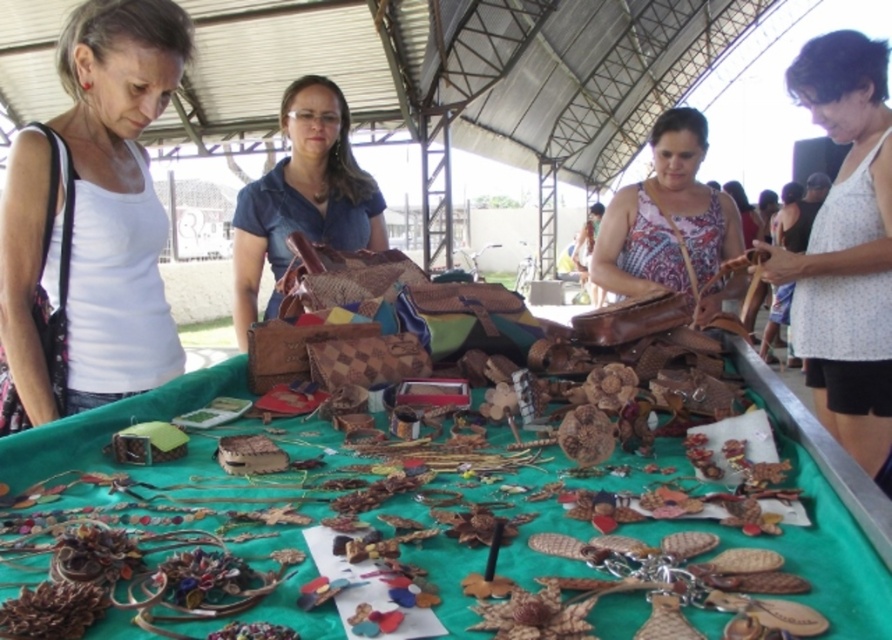
Looking at this image, you are a vendor at the market and want to display both the matte brown leather purse at center and the patterned fabric purse at center on a shelf. If the shelf has a width of 30 cm, can both purses fit side by side?

The matte brown leather purse at center is larger in width than the patterned fabric purse at center. However, without knowing the exact widths of each purse, it is impossible to determine if both can fit on a 30 cm shelf. More information is needed to confirm.